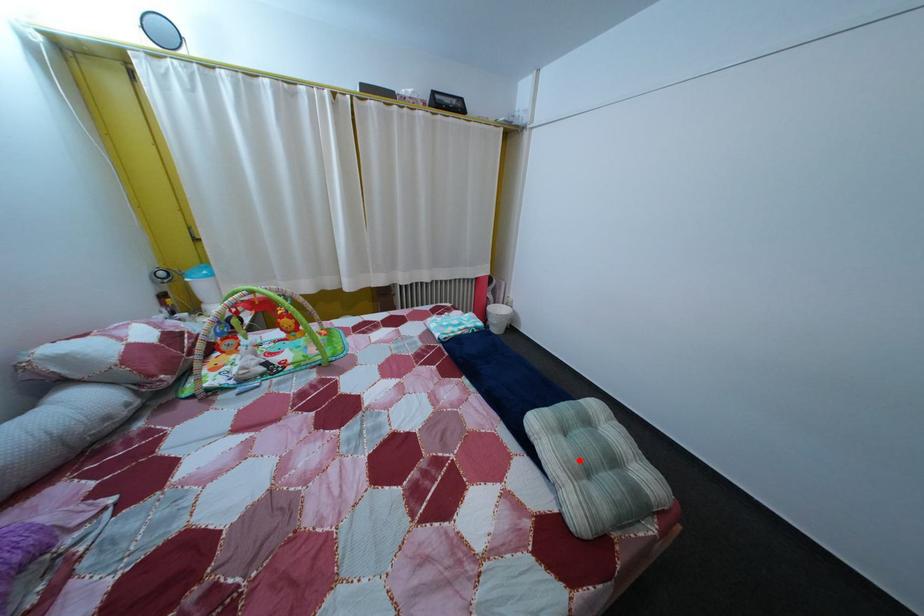
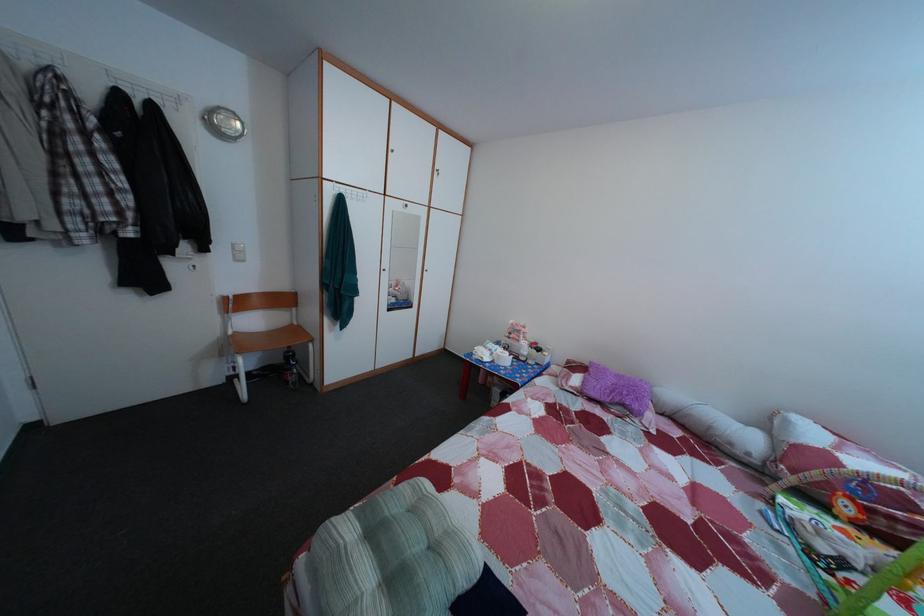
Question: I am providing you with two images of the same scene from different viewpoints. A red point is shown in image1. For the corresponding object point in image2, is it positioned nearer or farther from the camera?

Choices:
 (A) Nearer
 (B) Farther

Answer: (A)